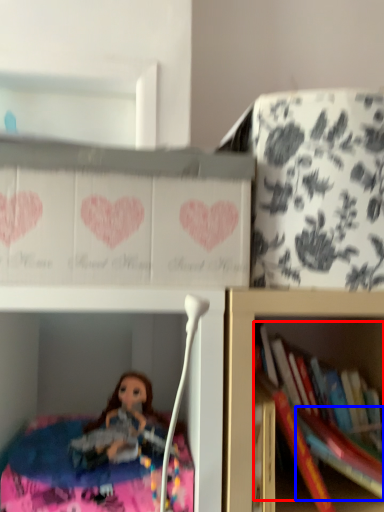
Question: Which point is further to the camera, book (highlighted by a red box) or book (highlighted by a blue box)?

Choices:
 (A) book
 (B) book

Answer: (A)